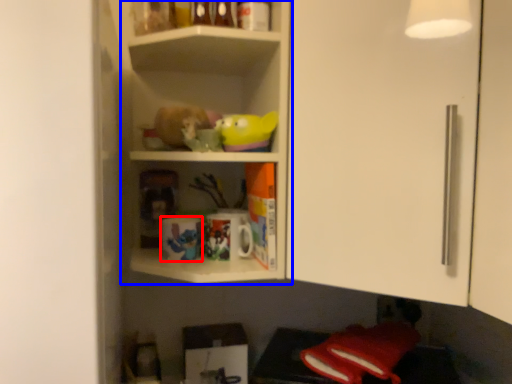
Question: Which point is further to the camera, mug (highlighted by a red box) or shelf (highlighted by a blue box)?

Choices:
 (A) mug
 (B) shelf

Answer: (A)